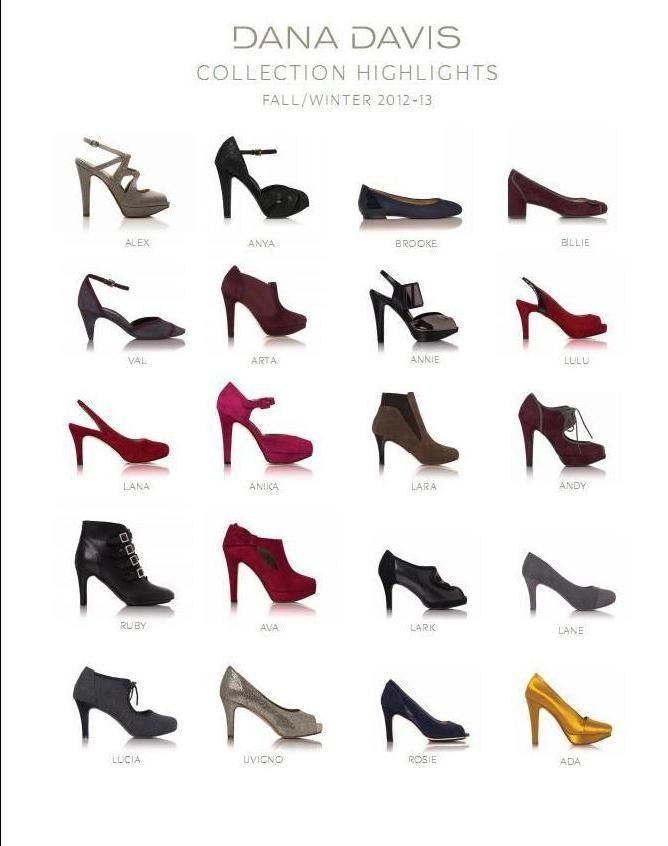
You are a GUI agent. You are given a task and a screenshot of the screen. Output one action in this format:
    pyautogui.click(x=<x>, y=<y>)
    Task: Click on the shoes in the top row
    
    Given the screenshot: What is the action you would take?
    pyautogui.click(x=141, y=202), pyautogui.click(x=395, y=209), pyautogui.click(x=576, y=202), pyautogui.click(x=266, y=198)